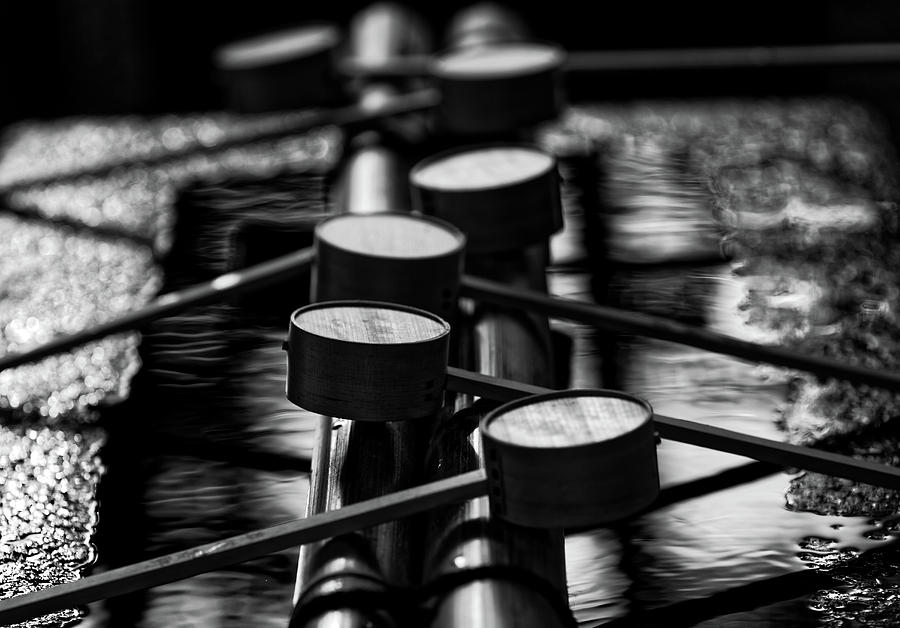
The width and height of the screenshot is (900, 628). In order to click on bar in this screenshot , I will do pyautogui.click(x=496, y=555).